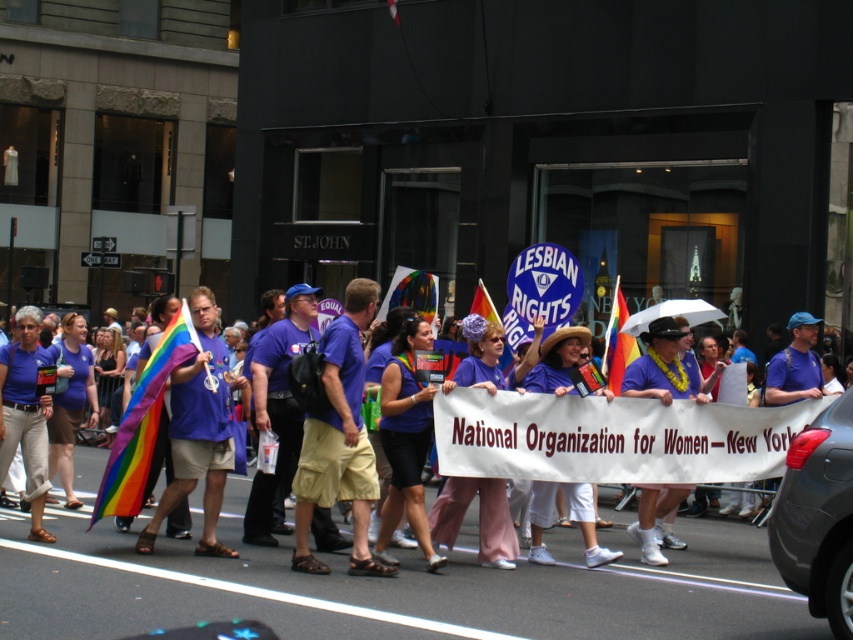
You are a photographer at the parade and want to capture both the purple fabric shorts at center and the matte blue shirt at center in a single frame. Which object should you focus on to ensure both are visible without cropping?

You should focus on the matte blue shirt at center because it occupies more space than the purple fabric shorts at center, making it easier to include both in the frame.

You are a photographer trying to capture the banner with the National Organization for Women text. You notice the purple fabric at center and the matte blue shirt at center in your frame. Which object should you move your camera to the left to focus on?

The purple fabric at center is to the right of the matte blue shirt at center. To focus on the purple fabric at center, move the camera to the left since it is positioned to the right of the matte blue shirt at center.

What is the spatial relationship between the purple fabric at center and the point labeled as point (x=479, y=518)?

The purple fabric at center is represented by point (x=479, y=518).